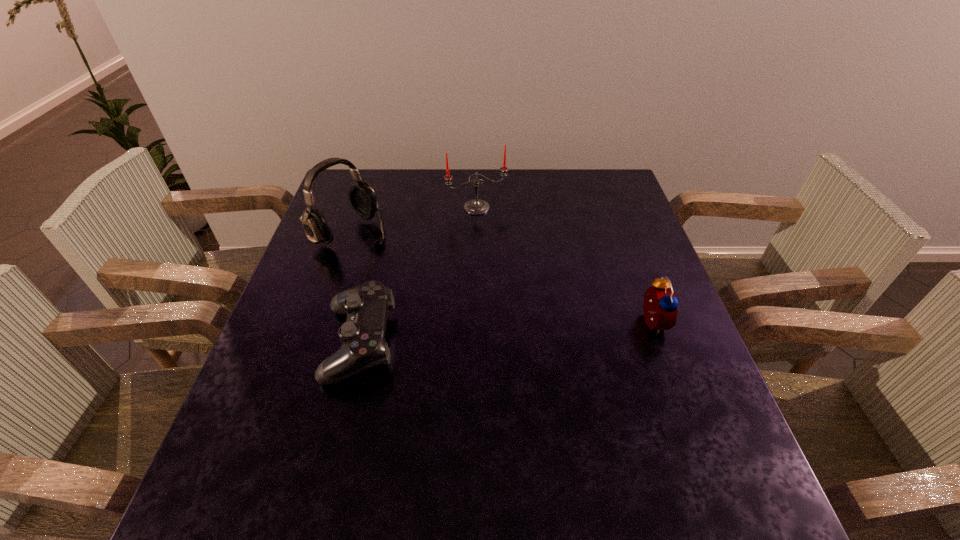
At what (x,y) coordinates should I click in order to perform the action: click on free space on the desktop that is between the control and the rightmost object and is positioned with the microphone on the side of the headset. Please return your answer as a coordinate pair (x, y). Looking at the image, I should click on (505, 333).

This screenshot has height=540, width=960. Identify the location of free space on the desktop that is between the shortest object and the rightmost object and is positioned on the front-facing side of the second object from right to left. (540, 330).